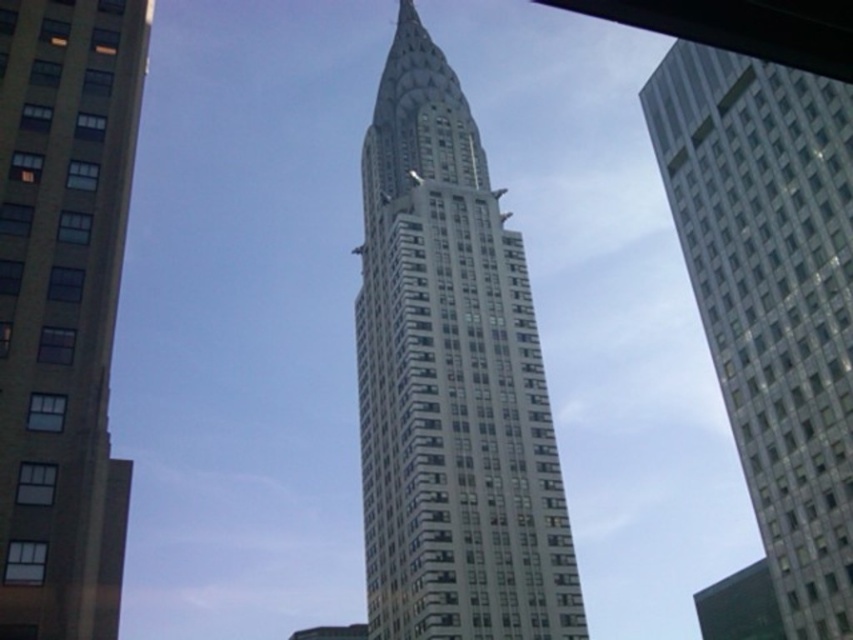
Based on the photo, which is above, glassy white skyscraper at right or smooth concrete building at center?

glassy white skyscraper at right is above.

Is glassy white skyscraper at right shorter than smooth concrete building at center?

In fact, glassy white skyscraper at right may be taller than smooth concrete building at center.

You are a GUI agent. You are given a task and a screenshot of the screen. Output one action in this format:
    pyautogui.click(x=<x>, y=<y>)
    Task: Click on the glassy white skyscraper at right
    The height and width of the screenshot is (640, 853).
    Given the screenshot: What is the action you would take?
    pyautogui.click(x=772, y=298)

Identify the location of glassy white skyscraper at right. The height and width of the screenshot is (640, 853). (772, 298).

Between point (439, 566) and point (836, 260), which one is positioned in front?

Point (836, 260)

Where is `white glass building at center`? This screenshot has height=640, width=853. white glass building at center is located at coordinates (451, 381).

Can you confirm if white glass building at center is taller than smooth concrete building at center?

Correct, white glass building at center is much taller as smooth concrete building at center.

Is white glass building at center closer to the viewer compared to smooth concrete building at center?

No, it is behind smooth concrete building at center.

Image resolution: width=853 pixels, height=640 pixels. In order to click on white glass building at center in this screenshot , I will do `click(451, 381)`.